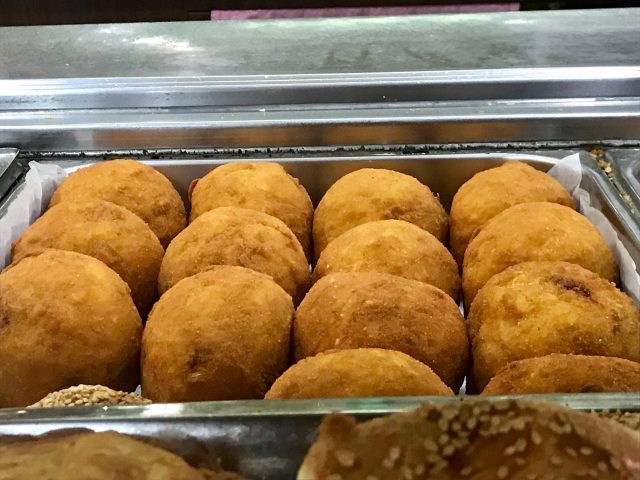
In order to click on metal trays in this screenshot , I will do `click(380, 404)`, `click(633, 177)`, `click(12, 189)`.